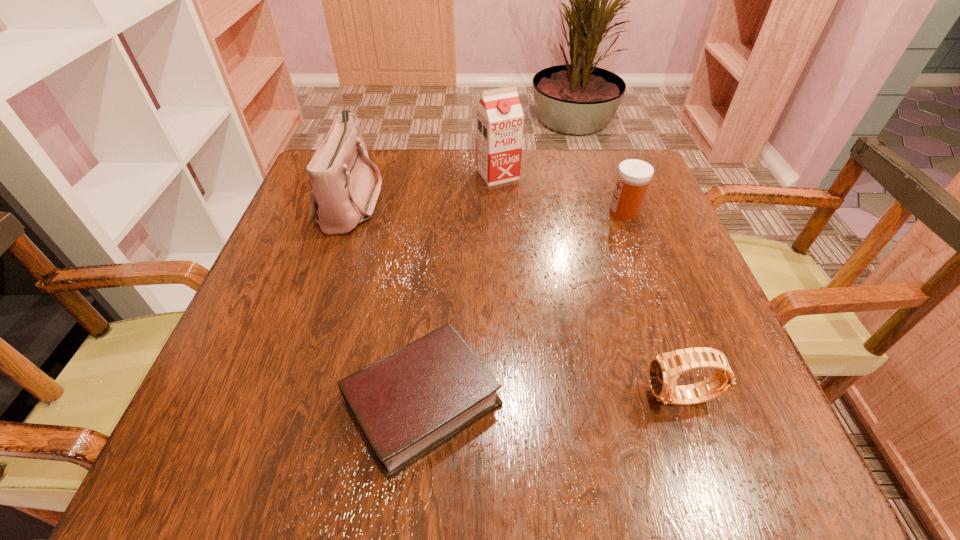
The image size is (960, 540). In order to click on free space at the near right corner of the desktop in this screenshot , I will do `click(765, 457)`.

Locate an element on the screen. This screenshot has width=960, height=540. free space between the second tallest object and the tallest object is located at coordinates (424, 187).

You are a GUI agent. You are given a task and a screenshot of the screen. Output one action in this format:
    pyautogui.click(x=<x>, y=<y>)
    Task: Click on the unoccupied position between the soya milk and the medicine
    The width and height of the screenshot is (960, 540).
    Given the screenshot: What is the action you would take?
    pyautogui.click(x=561, y=193)

Find the location of a particular element. blank region between the Bible and the watch is located at coordinates (552, 399).

This screenshot has height=540, width=960. What are the coordinates of `free space between the Bible and the watch` in the screenshot? It's located at (552, 399).

Where is `vacant space that is in between the medicine and the soya milk`? This screenshot has width=960, height=540. vacant space that is in between the medicine and the soya milk is located at coordinates (561, 193).

Identify the location of empty space that is in between the shortest object and the watch. pyautogui.click(x=552, y=399).

The image size is (960, 540). I want to click on empty space between the watch and the fourth shortest object, so click(516, 299).

Identify the location of unoccupied area between the watch and the medicine. Image resolution: width=960 pixels, height=540 pixels. (653, 305).

Where is `free point between the shortest object and the watch`? The width and height of the screenshot is (960, 540). free point between the shortest object and the watch is located at coordinates (552, 399).